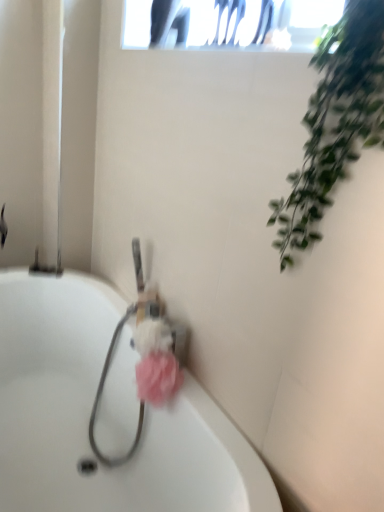
Question: Is pink fluffy sponge at center, the second flower positioned from the top, facing away from pink fluffy loofah at center, acting as the second flower starting from the bottom?

Choices:
 (A) no
 (B) yes

Answer: (B)

Question: Is pink fluffy sponge at center, which is counted as the first flower, starting from the bottom, to the left of pink fluffy loofah at center, positioned as the 1th flower in top-to-bottom order, from the viewer's perspective?

Choices:
 (A) no
 (B) yes

Answer: (A)

Question: Is pink fluffy sponge at center, the second flower positioned from the top, not close to pink fluffy loofah at center, positioned as the 1th flower in top-to-bottom order?

Choices:
 (A) no
 (B) yes

Answer: (A)

Question: Is pink fluffy sponge at center, which is counted as the first flower, starting from the bottom, positioned in front of pink fluffy loofah at center, positioned as the 1th flower in top-to-bottom order?

Choices:
 (A) yes
 (B) no

Answer: (A)

Question: Is pink fluffy loofah at center, positioned as the 1th flower in top-to-bottom order, inside pink fluffy sponge at center, which is counted as the first flower, starting from the bottom?

Choices:
 (A) yes
 (B) no

Answer: (B)

Question: From a real-world perspective, relative to pink fluffy loofah at center, positioned as the 1th flower in top-to-bottom order, is pink fluffy sponge at center, the second flower positioned from the top, vertically above or below?

Choices:
 (A) below
 (B) above

Answer: (A)

Question: Is pink fluffy sponge at center, which is counted as the first flower, starting from the bottom, in front of or behind pink fluffy loofah at center, acting as the second flower starting from the bottom, in the image?

Choices:
 (A) behind
 (B) front

Answer: (B)

Question: Is pink fluffy sponge at center, which is counted as the first flower, starting from the bottom, taller or shorter than pink fluffy loofah at center, positioned as the 1th flower in top-to-bottom order?

Choices:
 (A) tall
 (B) short

Answer: (A)

Question: In terms of width, does pink fluffy sponge at center, the second flower positioned from the top, look wider or thinner when compared to pink fluffy loofah at center, positioned as the 1th flower in top-to-bottom order?

Choices:
 (A) wide
 (B) thin

Answer: (B)

Question: From a real-world perspective, relative to white glossy bathtub at center, is pink fluffy sponge at center, the second flower positioned from the top, vertically above or below?

Choices:
 (A) below
 (B) above

Answer: (B)

Question: Based on their positions, is pink fluffy sponge at center, the second flower positioned from the top, located to the left or right of white glossy bathtub at center?

Choices:
 (A) right
 (B) left

Answer: (A)

Question: Is pink fluffy sponge at center, which is counted as the first flower, starting from the bottom, situated inside white glossy bathtub at center or outside?

Choices:
 (A) outside
 (B) inside

Answer: (B)

Question: Looking at the image, does pink fluffy sponge at center, the second flower positioned from the top, seem bigger or smaller compared to white glossy bathtub at center?

Choices:
 (A) big
 (B) small

Answer: (B)

Question: Based on their sizes in the image, would you say green leafy plant at upper right is bigger or smaller than pink fluffy loofah at center, acting as the second flower starting from the bottom?

Choices:
 (A) big
 (B) small

Answer: (A)

Question: Choose the correct answer: Is green leafy plant at upper right inside pink fluffy loofah at center, positioned as the 1th flower in top-to-bottom order, or outside it?

Choices:
 (A) inside
 (B) outside

Answer: (B)